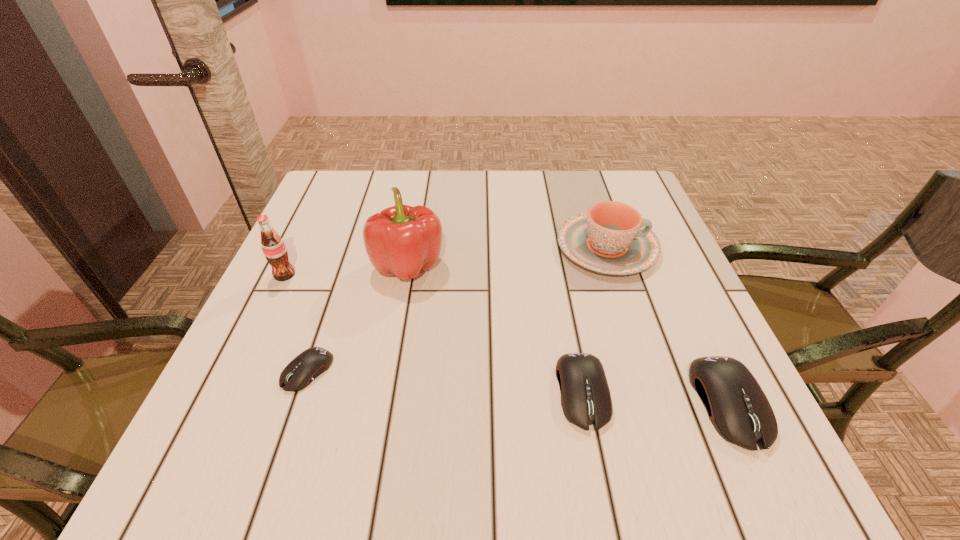
Identify the location of object located in the near right corner section of the desktop. This screenshot has width=960, height=540. (737, 407).

In the image, there is a desktop. Identify the location of free region at the far edge. click(x=443, y=183).

In order to click on blank space at the left edge of the desktop in this screenshot , I will do `click(285, 307)`.

Identify the location of free space at the far left corner of the desktop. 316,220.

In the image, there is a desktop. Identify the location of free space at the near left corner. The image size is (960, 540). (221, 413).

Image resolution: width=960 pixels, height=540 pixels. In the image, there is a desktop. In order to click on free space at the far right corner in this screenshot , I will do `click(597, 174)`.

Where is `vacant region between the rightmost computer equipment and the pepper`? vacant region between the rightmost computer equipment and the pepper is located at coordinates (568, 334).

Find the location of a particular element. This screenshot has width=960, height=540. vacant space in between the shortest object and the leftmost object is located at coordinates (296, 323).

Find the location of `vacant area between the third tallest object and the fourth object from right to left`. vacant area between the third tallest object and the fourth object from right to left is located at coordinates (507, 256).

Find the location of a particular element. vacant space in between the soda and the rightmost computer equipment is located at coordinates (506, 339).